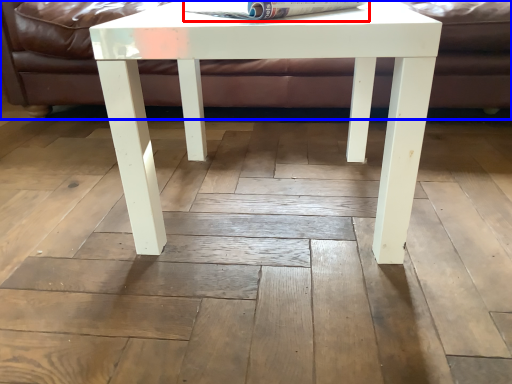
Question: Which point is further to the camera, magazine (highlighted by a red box) or couch (highlighted by a blue box)?

Choices:
 (A) magazine
 (B) couch

Answer: (B)